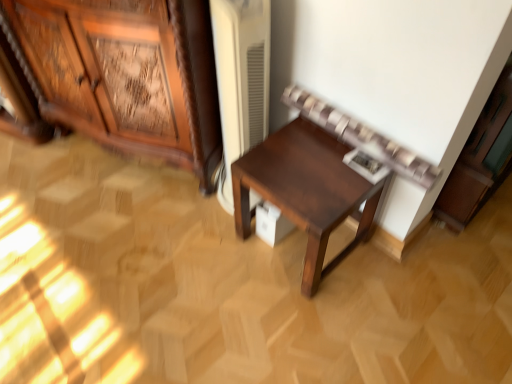
Question: Are dark wood table at center and white matte cabinet at upper right, placed as the 2th cabinetry when sorted from left to right, beside each other?

Choices:
 (A) no
 (B) yes

Answer: (A)

Question: Considering the relative sizes of dark wood table at center and white matte cabinet at upper right, arranged as the 1th cabinetry when viewed from the right, in the image provided, is dark wood table at center smaller than white matte cabinet at upper right, arranged as the 1th cabinetry when viewed from the right,?

Choices:
 (A) yes
 (B) no

Answer: (A)

Question: Is dark wood table at center positioned far away from white matte cabinet at upper right, placed as the 2th cabinetry when sorted from left to right?

Choices:
 (A) yes
 (B) no

Answer: (B)

Question: Is dark wood table at center turned away from white matte cabinet at upper right, placed as the 2th cabinetry when sorted from left to right?

Choices:
 (A) no
 (B) yes

Answer: (B)

Question: From the image's perspective, is dark wood table at center below white matte cabinet at upper right, placed as the 2th cabinetry when sorted from left to right?

Choices:
 (A) yes
 (B) no

Answer: (A)

Question: From a real-world perspective, is dark wood table at center on top of white matte cabinet at upper right, arranged as the 1th cabinetry when viewed from the right?

Choices:
 (A) no
 (B) yes

Answer: (A)

Question: Is dark wood table at center outside of wooden carved cabinet at left, which is counted as the 2th cabinetry, starting from the right?

Choices:
 (A) no
 (B) yes

Answer: (B)

Question: Is dark wood table at center to the left of wooden carved cabinet at left, the first cabinetry viewed from the left, from the viewer's perspective?

Choices:
 (A) yes
 (B) no

Answer: (B)

Question: Considering the relative positions of dark wood table at center and wooden carved cabinet at left, the first cabinetry viewed from the left, in the image provided, is dark wood table at center in front of wooden carved cabinet at left, the first cabinetry viewed from the left,?

Choices:
 (A) no
 (B) yes

Answer: (A)

Question: Considering the relative positions of dark wood table at center and wooden carved cabinet at left, the first cabinetry viewed from the left, in the image provided, is dark wood table at center to the right of wooden carved cabinet at left, the first cabinetry viewed from the left, from the viewer's perspective?

Choices:
 (A) yes
 (B) no

Answer: (A)

Question: Can you confirm if dark wood table at center is smaller than wooden carved cabinet at left, which is counted as the 2th cabinetry, starting from the right?

Choices:
 (A) yes
 (B) no

Answer: (A)

Question: Does dark wood table at center turn towards wooden carved cabinet at left, which is counted as the 2th cabinetry, starting from the right?

Choices:
 (A) no
 (B) yes

Answer: (A)

Question: Is wooden carved cabinet at left, which is counted as the 2th cabinetry, starting from the right, aimed at white matte cabinet at upper right, placed as the 2th cabinetry when sorted from left to right?

Choices:
 (A) yes
 (B) no

Answer: (B)